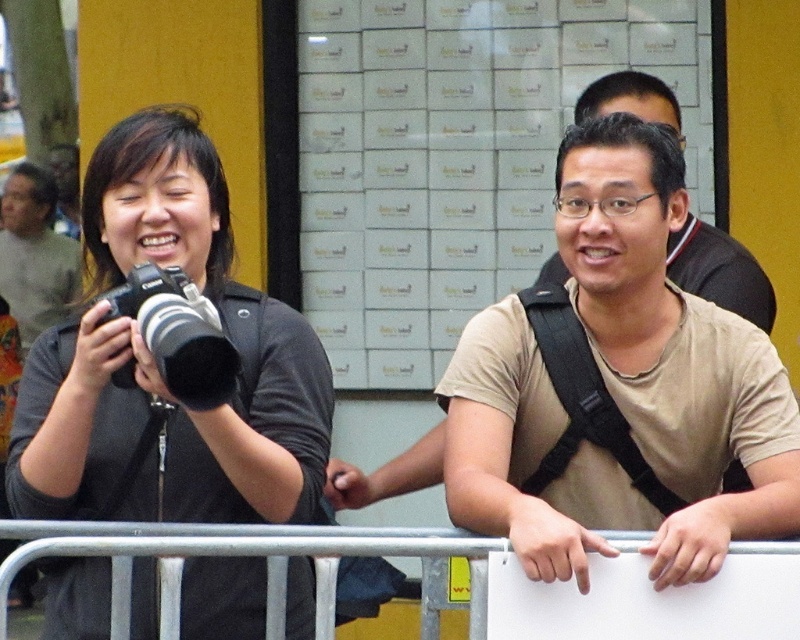
Question: Which is nearer to the tan cotton t-shirt at center?

Choices:
 (A) black matte camera at left
 (B) metal at center
 (C) matte black camera at left
 (D) gray sweater at left

Answer: (B)

Question: Can you confirm if tan cotton t-shirt at center is bigger than gray sweater at left?

Choices:
 (A) no
 (B) yes

Answer: (A)

Question: Which is nearer to the metal at center?

Choices:
 (A) matte black camera at left
 (B) black matte camera at left
 (C) gray sweater at left
 (D) tan cotton t-shirt at center

Answer: (A)

Question: Does tan cotton t-shirt at center lie behind metal at center?

Choices:
 (A) yes
 (B) no

Answer: (A)

Question: From the image, what is the correct spatial relationship of tan cotton t-shirt at center in relation to metal at center?

Choices:
 (A) right
 (B) left

Answer: (A)

Question: Which point is farther to the camera?

Choices:
 (A) gray sweater at left
 (B) matte black camera at left

Answer: (A)